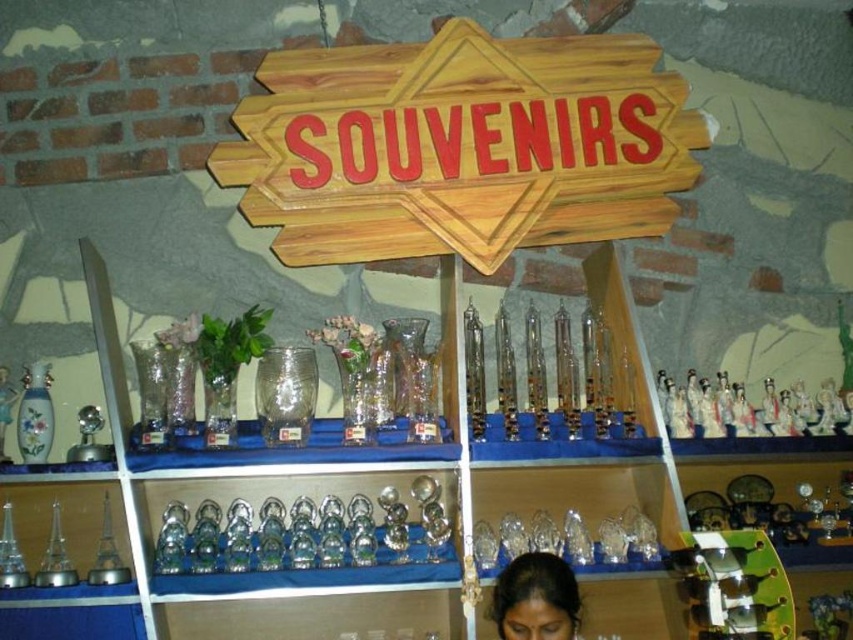
Does wooden sign at upper center have a greater width compared to black hair at lower center?

Yes, wooden sign at upper center is wider than black hair at lower center.

Is wooden sign at upper center above black hair at lower center?

Yes.

Is point (459, 45) positioned after point (577, 602)?

Yes, point (459, 45) is behind point (577, 602).

Locate an element on the screen. Image resolution: width=853 pixels, height=640 pixels. wooden sign at upper center is located at coordinates (461, 147).